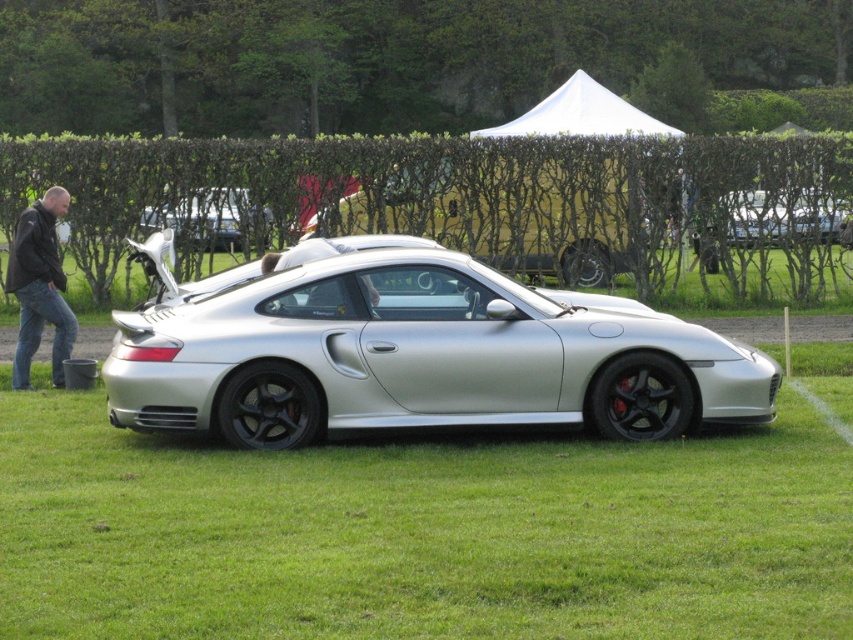
You are a photographer setting up a shoot for a car magazine. You have a pair of jeans at left and a satin silver car at center in your frame. The editor wants to ensure the jeans don not block the car in the photo. Based on their heights, will the jeans be visible above the car in the image?

The jeans at left are taller than the satin silver car at center, so yes, the jeans will be visible above the car in the image.

You are standing in front of the silver Porsche sports car on the grassy field. You notice two points marked in the scene. The first point is at coordinates point (70, 346) and the second point is at point (148, 211). Which of these two points is nearer to you as you face the car?

Point (70, 346) is closer to the camera than point (148, 211), so the first point is nearer to you.

You are a photographer setting up equipment near the silver metallic sports car at center and the satin silver car at center. Which car should you position closer to your camera to capture more details without zooming in?

You should position the silver metallic sports car at center closer to the camera since it is larger than the satin silver car at center, allowing for better detail capture without zooming.